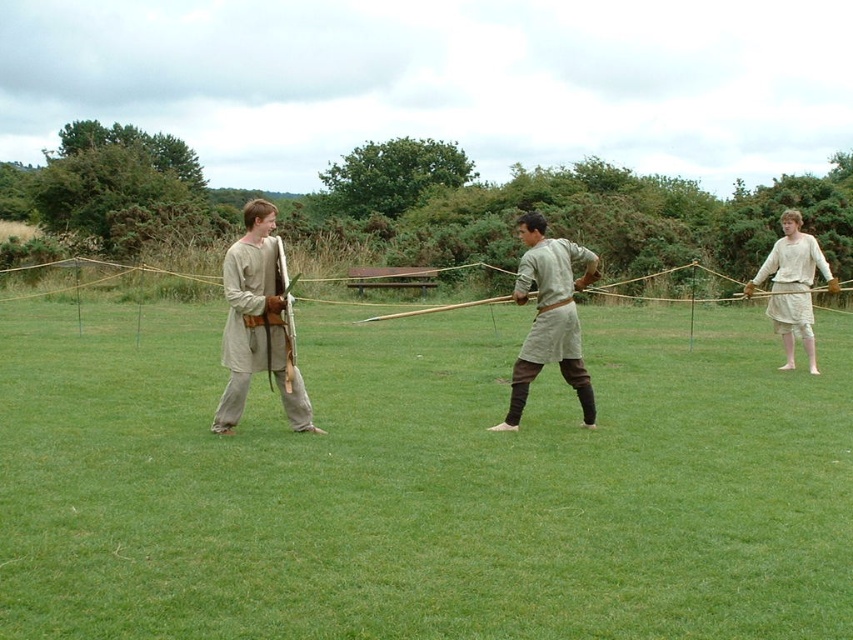
Question: Is light beige linen shirt at right to the right of brown rope at center from the viewer's perspective?

Choices:
 (A) no
 (B) yes

Answer: (B)

Question: Which of these objects is positioned farthest from the green grass at center?

Choices:
 (A) light beige fabric shirt at left
 (B) light beige linen shirt at right
 (C) light beige fabric shirt at center

Answer: (B)

Question: Does green grass at center appear on the right side of light beige linen shirt at right?

Choices:
 (A) no
 (B) yes

Answer: (A)

Question: Among these objects, which one is farthest from the camera?

Choices:
 (A) green grass at center
 (B) light beige linen shirt at right
 (C) light beige fabric shirt at center

Answer: (B)

Question: Does light beige fabric shirt at left appear on the right side of light beige fabric shirt at center?

Choices:
 (A) no
 (B) yes

Answer: (A)

Question: Estimate the real-world distances between objects in this image. Which object is closer to the light beige fabric shirt at center?

Choices:
 (A) light beige linen shirt at right
 (B) green grass at center
 (C) brown rope at center
 (D) light beige fabric shirt at left

Answer: (D)